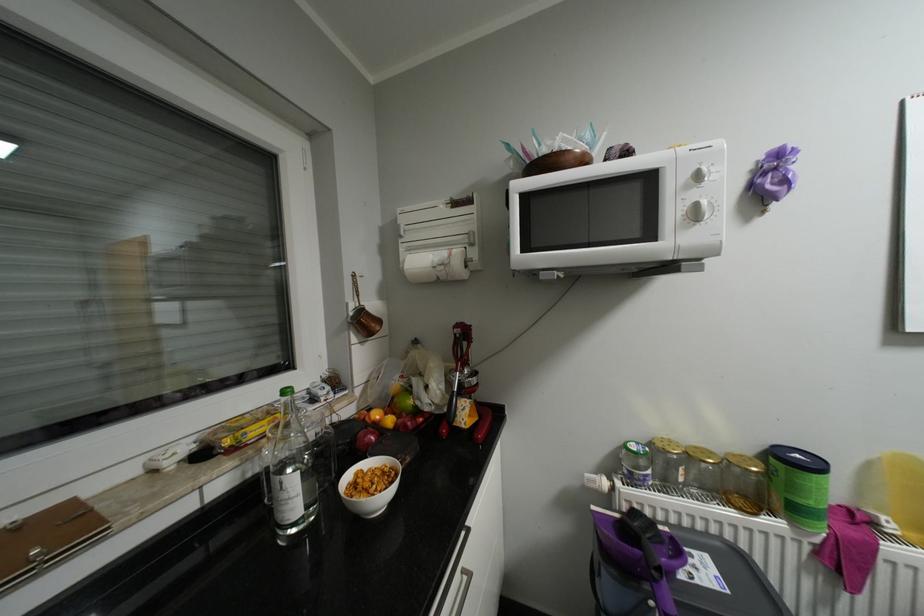
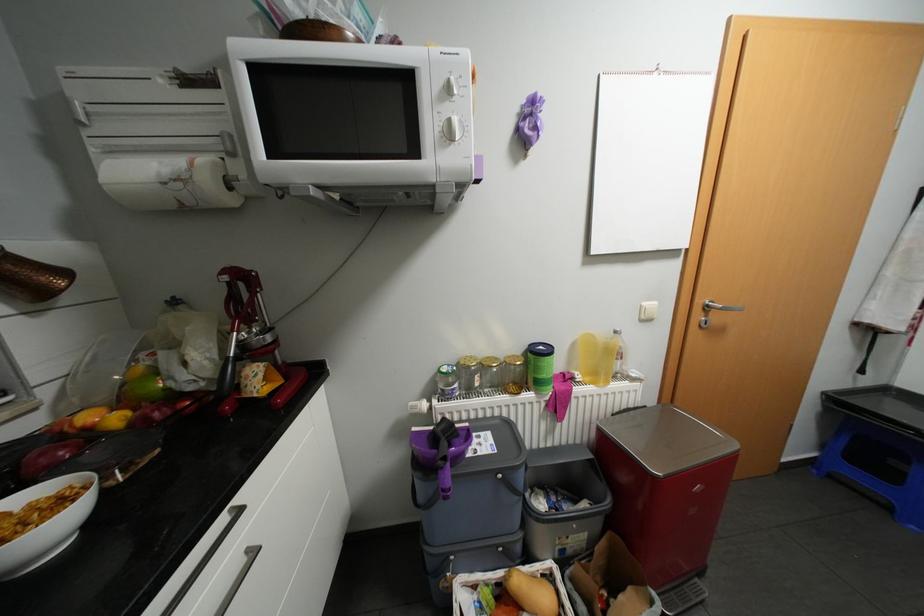
Find the pixel in the second image that matches point (703, 447) in the first image.

(495, 357)